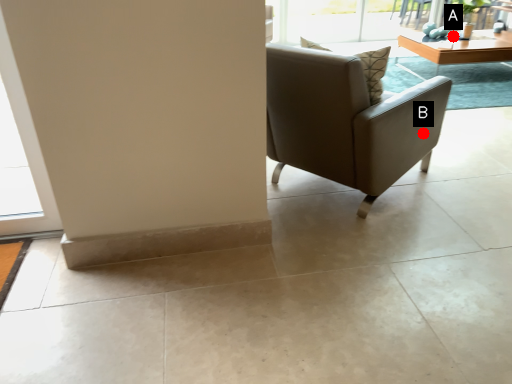
Question: Two points are circled on the image, labeled by A and B beside each circle. Which point appears closest to the camera in this image?

Choices:
 (A) A is closer
 (B) B is closer

Answer: (B)